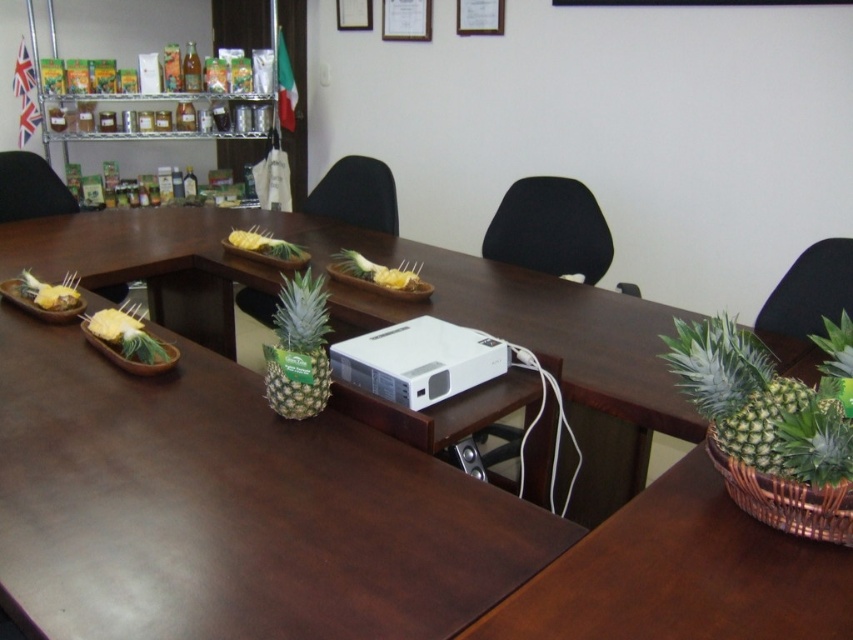
Question: From the image, what is the correct spatial relationship of black leather chair at left in relation to yellow-green pineapple at center?

Choices:
 (A) above
 (B) below

Answer: (A)

Question: Does black leather chair at upper right appear over black plastic chair at center?

Choices:
 (A) no
 (B) yes

Answer: (A)

Question: Is brown wood table at lower right to the left of yellow-green pineapple at center from the viewer's perspective?

Choices:
 (A) yes
 (B) no

Answer: (B)

Question: Which point is closer to the camera?

Choices:
 (A) (380, 195)
 (B) (57, 285)
 (C) (316, 353)
 (D) (850, 257)

Answer: (C)

Question: Which point appears closest to the camera in this image?

Choices:
 (A) (647, 426)
 (B) (64, 200)

Answer: (A)

Question: Considering the real-world distances, which object is closest to the black fabric chair at center?

Choices:
 (A) green matte pineapple at lower right
 (B) black plastic chair at center

Answer: (B)